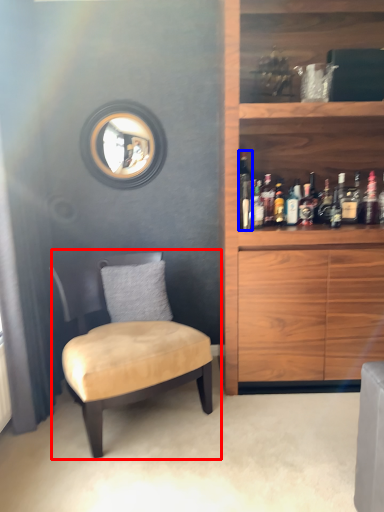
Question: Which object is closer to the camera taking this photo, chair (highlighted by a red box) or bottle (highlighted by a blue box)?

Choices:
 (A) chair
 (B) bottle

Answer: (A)